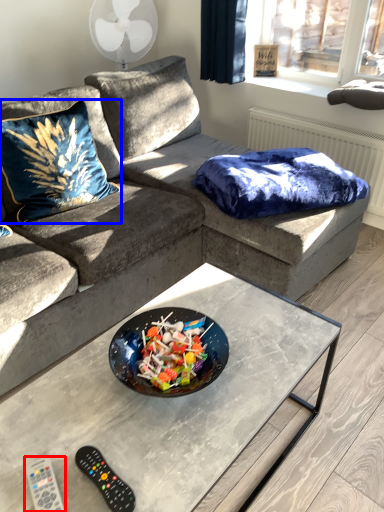
Question: Which point is further to the camera, remote (highlighted by a red box) or throw pillow (highlighted by a blue box)?

Choices:
 (A) remote
 (B) throw pillow

Answer: (B)